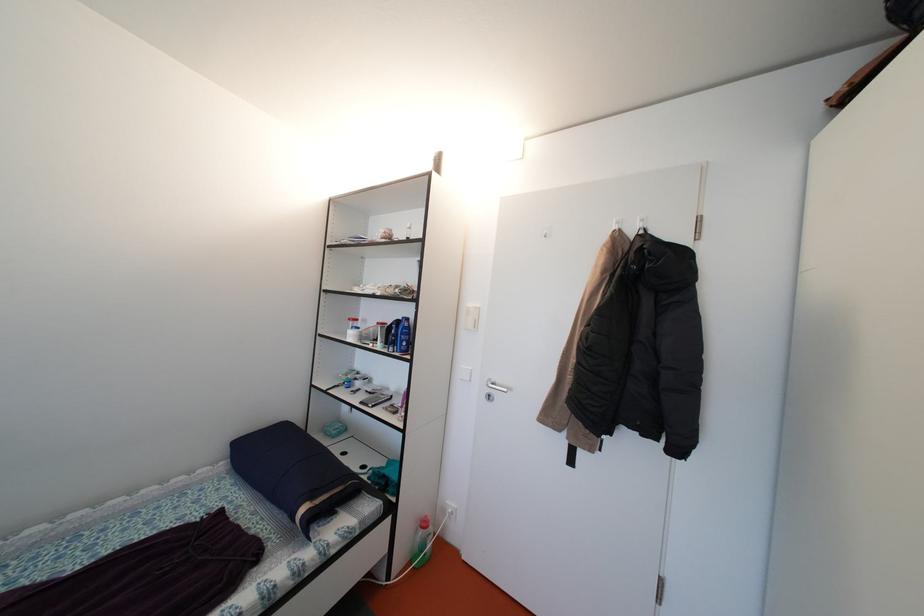
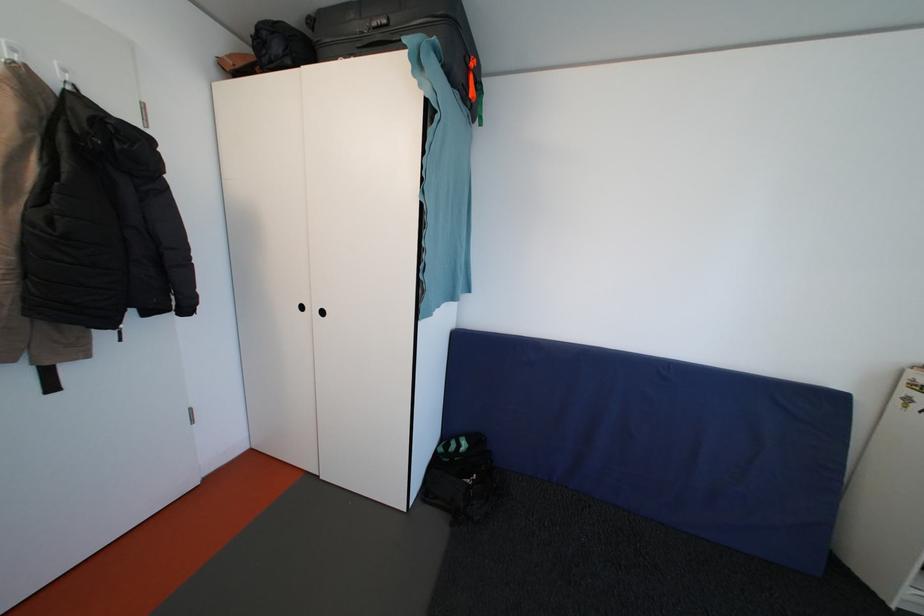
Based on the continuous images, in which direction is the camera rotating?

The camera's rotation is toward right-down.